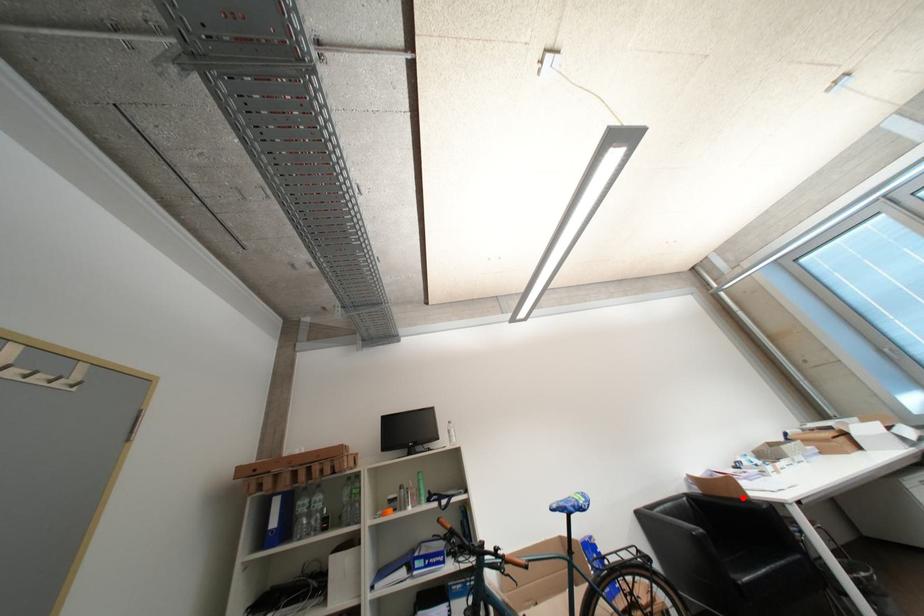
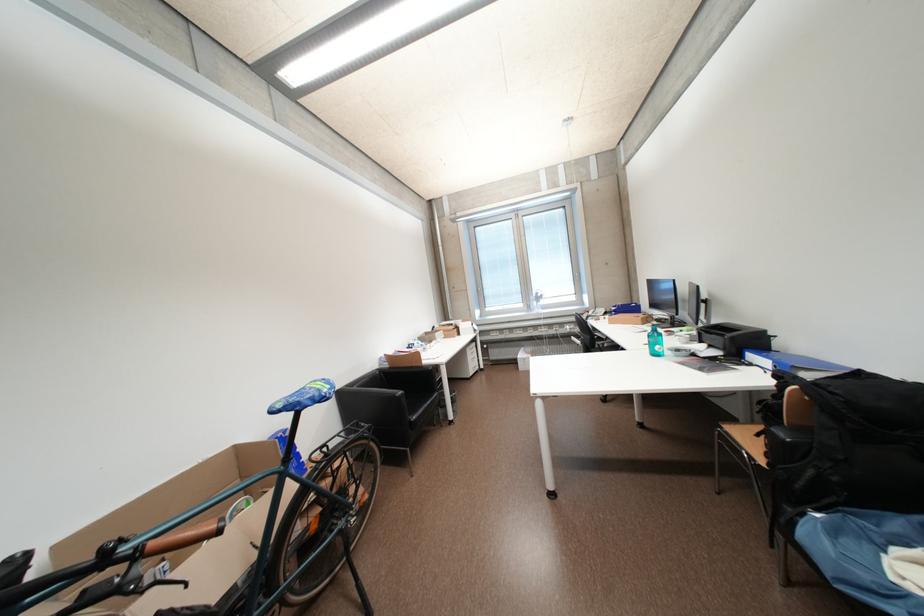
Question: I am providing you with two images of the same scene from different viewpoints. Image1 has a red point marked. In image2, the corresponding 3D location appears at what relative position? Reply with the corresponding letter.

Choices:
 (A) Closer
 (B) Farther

Answer: (B)